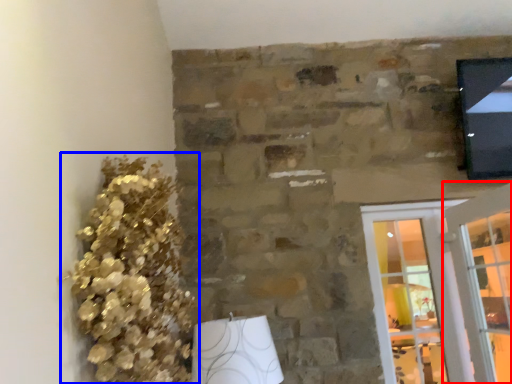
Question: Which object is closer to the camera taking this photo, glass door (highlighted by a red box) or floral arrangement (highlighted by a blue box)?

Choices:
 (A) glass door
 (B) floral arrangement

Answer: (B)